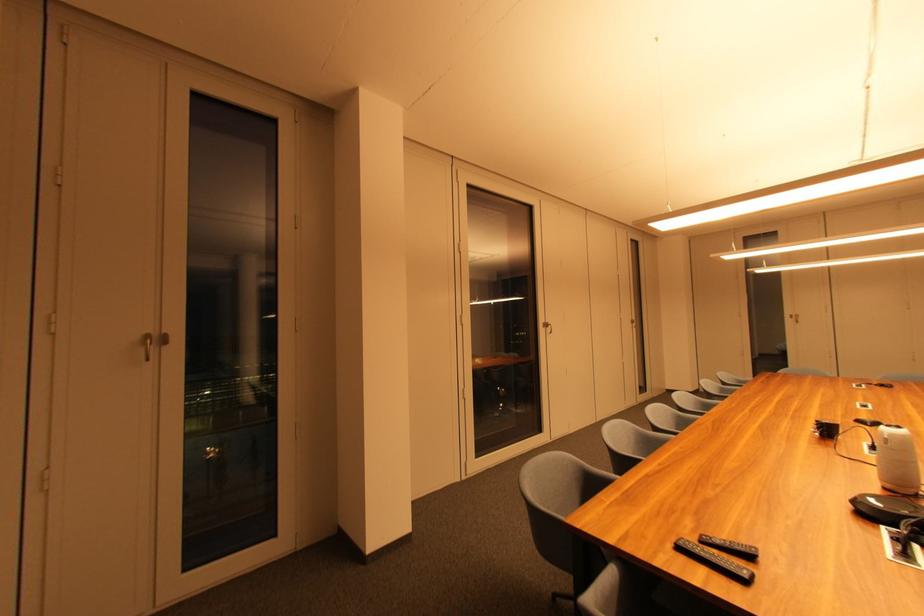
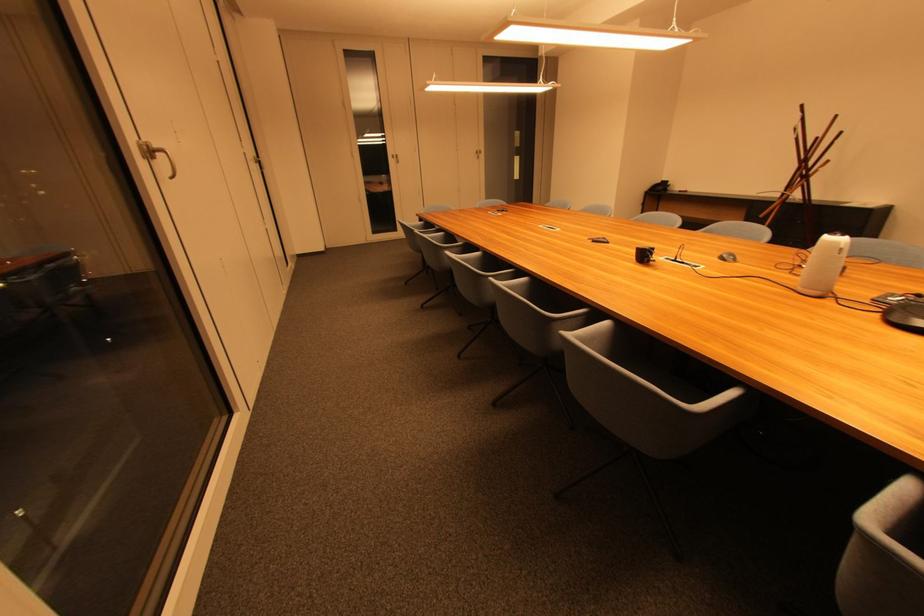
The point at (x=833, y=432) is marked in the first image. Where is the corresponding point in the second image?

(649, 257)